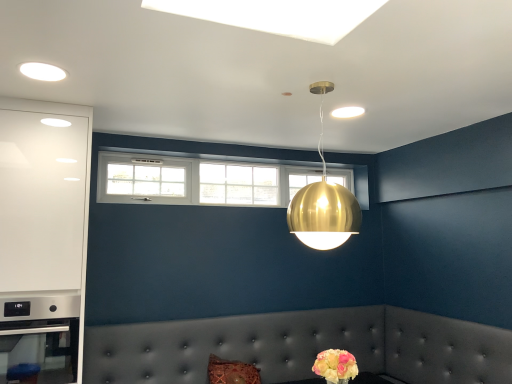
Measure the distance between pastel yellow bouquet at lower right and camera.

pastel yellow bouquet at lower right and camera are 6.06 feet apart from each other.

The image size is (512, 384). What do you see at coordinates (198, 181) in the screenshot?
I see `white glass window at upper center` at bounding box center [198, 181].

What do you see at coordinates (323, 202) in the screenshot? I see `gold metallic sphere at upper center` at bounding box center [323, 202].

Locate an element on the screen. white glossy cabinet at left is located at coordinates (42, 236).

From the image's perspective, is satin silver oven at lower left located beneath pastel yellow bouquet at lower right?

No, from the image's perspective, satin silver oven at lower left is not below pastel yellow bouquet at lower right.

Consider the image. Between satin silver oven at lower left and pastel yellow bouquet at lower right, which one has larger width?

With larger width is satin silver oven at lower left.

Does satin silver oven at lower left have a greater height compared to pastel yellow bouquet at lower right?

Indeed, satin silver oven at lower left has a greater height compared to pastel yellow bouquet at lower right.

You are a GUI agent. You are given a task and a screenshot of the screen. Output one action in this format:
    pyautogui.click(x=<x>, y=<y>)
    Task: Click on the flower lying in front of the satin silver oven at lower left
    The height and width of the screenshot is (384, 512).
    Given the screenshot: What is the action you would take?
    pyautogui.click(x=336, y=366)

Is the surface of gold metallic sphere at upper center in direct contact with tufted leather couch at lower center?

No, gold metallic sphere at upper center is not in contact with tufted leather couch at lower center.

In the scene shown: Is gold metallic sphere at upper center further to the viewer compared to tufted leather couch at lower center?

No, gold metallic sphere at upper center is in front of tufted leather couch at lower center.

In order to click on lamp in front of the tufted leather couch at lower center in this screenshot , I will do `click(323, 202)`.

Considering the sizes of objects gold metallic sphere at upper center and tufted leather couch at lower center in the image provided, who is thinner, gold metallic sphere at upper center or tufted leather couch at lower center?

gold metallic sphere at upper center.

From the image's perspective, does tufted leather couch at lower center appear higher than gold metallic sphere at upper center?

Incorrect, from the image's perspective, tufted leather couch at lower center is lower than gold metallic sphere at upper center.

Which is behind, tufted leather couch at lower center or gold metallic sphere at upper center?

Positioned behind is tufted leather couch at lower center.

Does tufted leather couch at lower center appear on the left side of gold metallic sphere at upper center?

Correct, you'll find tufted leather couch at lower center to the left of gold metallic sphere at upper center.

Could you tell me if tufted leather couch at lower center is facing gold metallic sphere at upper center?

No, tufted leather couch at lower center is not facing towards gold metallic sphere at upper center.

Is satin silver oven at lower left next to gold metallic sphere at upper center?

No, satin silver oven at lower left is not in contact with gold metallic sphere at upper center.

Choose the correct answer: Is satin silver oven at lower left inside gold metallic sphere at upper center or outside it?

satin silver oven at lower left lies outside gold metallic sphere at upper center.

Considering the sizes of satin silver oven at lower left and gold metallic sphere at upper center in the image, is satin silver oven at lower left wider or thinner than gold metallic sphere at upper center?

satin silver oven at lower left is wider than gold metallic sphere at upper center.

Where is `appliance that is under the gold metallic sphere at upper center (from a real-world perspective)`? appliance that is under the gold metallic sphere at upper center (from a real-world perspective) is located at coordinates (39, 337).

Looking at this image, is pastel yellow bouquet at lower right positioned beyond the bounds of tufted leather couch at lower center?

Indeed, pastel yellow bouquet at lower right is completely outside tufted leather couch at lower center.

The image size is (512, 384). I want to click on couch below the pastel yellow bouquet at lower right (from the image's perspective), so click(302, 346).

Is pastel yellow bouquet at lower right to the left of tufted leather couch at lower center from the viewer's perspective?

No.

Based on the photo, can we say gold metallic sphere at upper center lies outside white glass window at upper center?

That's correct, gold metallic sphere at upper center is outside of white glass window at upper center.

In the scene shown: Considering their positions, is gold metallic sphere at upper center located in front of or behind white glass window at upper center?

gold metallic sphere at upper center is in front of white glass window at upper center.

Between gold metallic sphere at upper center and white glass window at upper center, which one has smaller width?

white glass window at upper center is thinner.

From the image's perspective, is gold metallic sphere at upper center above white glass window at upper center?

Yes, from the image's perspective, gold metallic sphere at upper center is above white glass window at upper center.

Could you tell me if pastel yellow bouquet at lower right is turned towards white glossy cabinet at left?

No, pastel yellow bouquet at lower right is not aimed at white glossy cabinet at left.

Is pastel yellow bouquet at lower right outside of white glossy cabinet at left?

Yes, pastel yellow bouquet at lower right is located beyond the bounds of white glossy cabinet at left.

Between pastel yellow bouquet at lower right and white glossy cabinet at left, which one has less height?

Standing shorter between the two is pastel yellow bouquet at lower right.

From the image's perspective, is pastel yellow bouquet at lower right above or below white glossy cabinet at left?

From the image's perspective, pastel yellow bouquet at lower right appears below white glossy cabinet at left.

Locate an element on the screen. The image size is (512, 384). appliance that is behind the pastel yellow bouquet at lower right is located at coordinates tap(39, 337).

The image size is (512, 384). In order to click on couch below the gold metallic sphere at upper center (from the image's perspective) in this screenshot , I will do `click(302, 346)`.

Looking at the image, which one is located closer to tufted leather couch at lower center, gold metallic sphere at upper center or white glass window at upper center?

white glass window at upper center.

Based on their spatial positions, is pastel yellow bouquet at lower right or satin silver oven at lower left closer to tufted leather couch at lower center?

satin silver oven at lower left is positioned closer to the anchor tufted leather couch at lower center.

When comparing their distances from satin silver oven at lower left, does gold metallic sphere at upper center or white glossy cabinet at left seem further?

gold metallic sphere at upper center.

From the image, which object appears to be farther from tufted leather couch at lower center, white glossy cabinet at left or gold metallic sphere at upper center?

gold metallic sphere at upper center.

Based on their spatial positions, is gold metallic sphere at upper center or tufted leather couch at lower center closer to satin silver oven at lower left?

The object closer to satin silver oven at lower left is tufted leather couch at lower center.

Estimate the real-world distances between objects in this image. Which object is further from satin silver oven at lower left, white glossy cabinet at left or white glass window at upper center?

white glass window at upper center is positioned further to the anchor satin silver oven at lower left.

From the image, which object appears to be nearer to pastel yellow bouquet at lower right, satin silver oven at lower left or tufted leather couch at lower center?

tufted leather couch at lower center is closer to pastel yellow bouquet at lower right.

Consider the image. When comparing their distances from white glass window at upper center, does white glossy cabinet at left or satin silver oven at lower left seem closer?

white glossy cabinet at left.

Find the location of a particular element. This screenshot has width=512, height=384. window between white glossy cabinet at left and gold metallic sphere at upper center is located at coordinates (198, 181).

This screenshot has height=384, width=512. I want to click on appliance between white glossy cabinet at left and tufted leather couch at lower center in the horizontal direction, so click(x=39, y=337).

At what (x,y) coordinates should I click in order to perform the action: click on appliance between white glossy cabinet at left and pastel yellow bouquet at lower right in the horizontal direction. Please return your answer as a coordinate pair (x, y). Looking at the image, I should click on (39, 337).

The width and height of the screenshot is (512, 384). In order to click on appliance between white glossy cabinet at left and white glass window at upper center from front to back in this screenshot , I will do `click(39, 337)`.